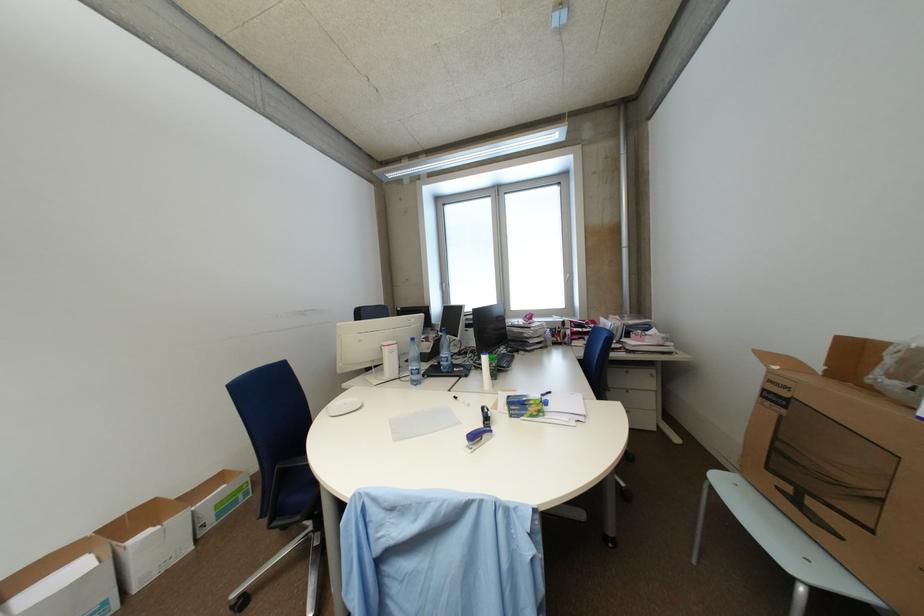
The width and height of the screenshot is (924, 616). What do you see at coordinates (444, 286) in the screenshot?
I see `the white window handle` at bounding box center [444, 286].